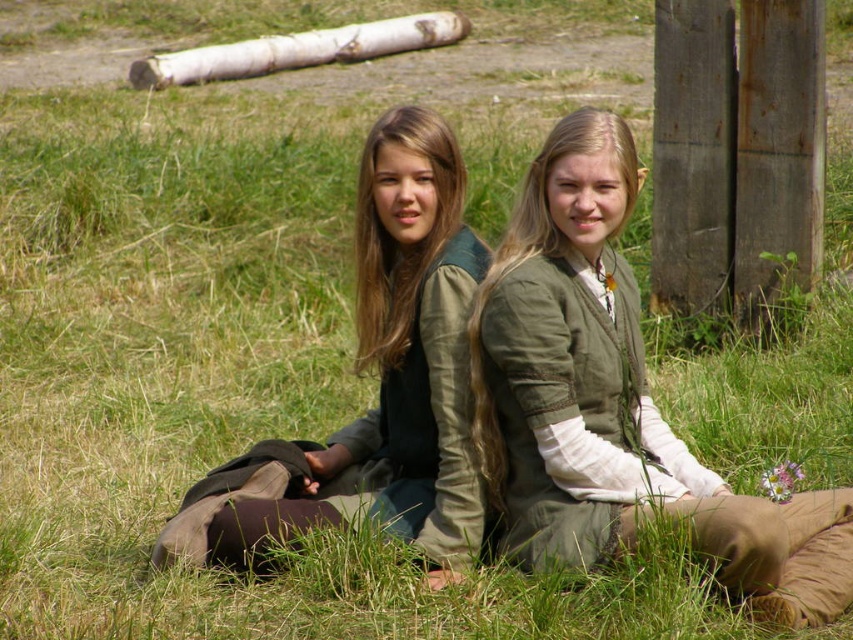
Question: Which of the following is the closest to the observer?

Choices:
 (A) (279, 61)
 (B) (242, 513)

Answer: (B)

Question: Which point appears farthest from the camera in this image?

Choices:
 (A) (358, 477)
 (B) (171, 68)
 (C) (805, 593)

Answer: (B)

Question: Does green linen tunic at center come in front of matte green vest at center?

Choices:
 (A) yes
 (B) no

Answer: (A)

Question: Among these objects, which one is farthest from the camera?

Choices:
 (A) white bark log at upper center
 (B) green linen tunic at center

Answer: (A)

Question: Is green linen tunic at center above white bark log at upper center?

Choices:
 (A) yes
 (B) no

Answer: (B)

Question: Can you confirm if green linen tunic at center is smaller than white bark log at upper center?

Choices:
 (A) no
 (B) yes

Answer: (B)